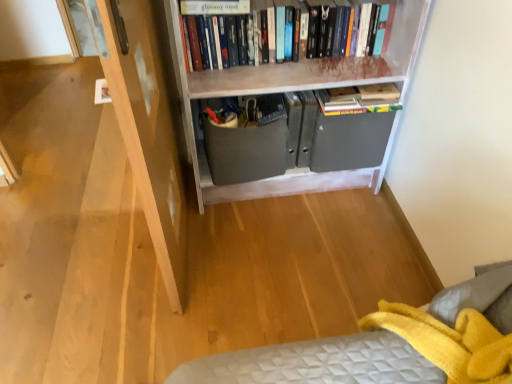
This screenshot has width=512, height=384. I want to click on unoccupied area in front of white painted wood bookcase at upper center, so click(x=290, y=263).